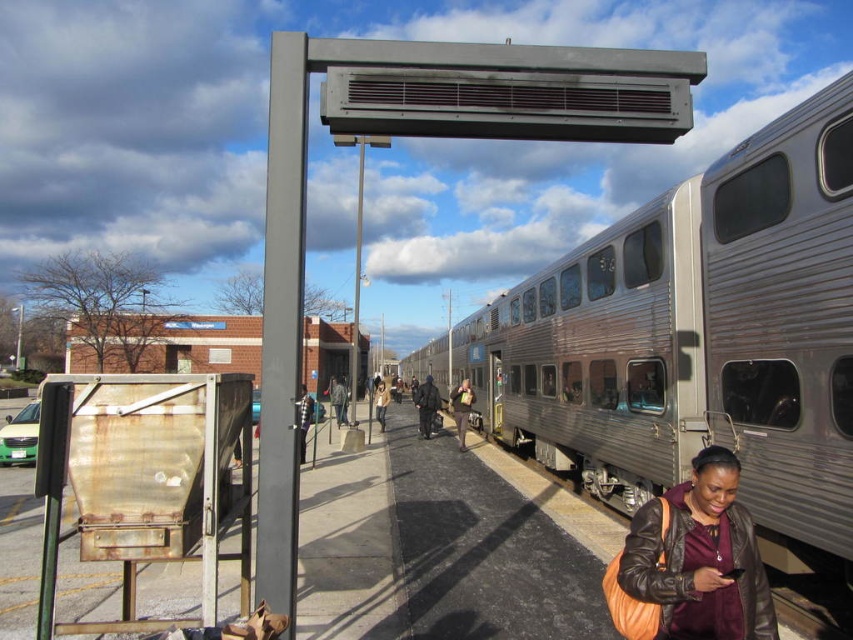
Question: Which point is closer to the camera taking this photo?

Choices:
 (A) (785, 129)
 (B) (682, 534)

Answer: (B)

Question: Is silver metallic train at center above leather jacket at lower right?

Choices:
 (A) no
 (B) yes

Answer: (A)

Question: Which point appears closest to the camera in this image?

Choices:
 (A) (619, 588)
 (B) (486, 308)

Answer: (A)

Question: Does silver metallic train at center have a lesser width compared to leather jacket at lower right?

Choices:
 (A) yes
 (B) no

Answer: (B)

Question: Can you confirm if silver metallic train at center is positioned above leather jacket at lower right?

Choices:
 (A) no
 (B) yes

Answer: (A)

Question: Which point is farther to the camera?

Choices:
 (A) leather jacket at lower right
 (B) silver metallic train at center

Answer: (B)